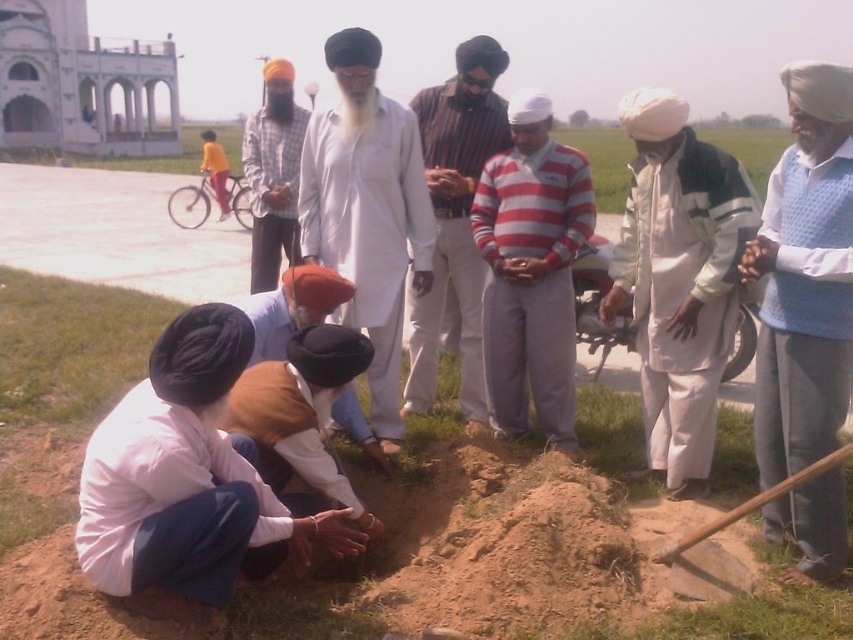
You are a farmer who needs to reach the person with the matte white turban at center from the white matte kurta at center. Given that your tractor has a turning radius of 2 meters, can you navigate your tractor between them without hitting either?

The distance between the white matte kurta at center and the matte white turban at center is 2.36 meters. Since the tractor requires a minimum turning radius of 2 meters, the tractor can navigate between them as the distance is sufficient to accommodate the turning radius.

You are a photographer standing at the camera position. You want to take a closeup photo of the white matte kurta at center. Can you walk closer to it without leaving the paved road shown in the scene?

The white matte kurta at center is 11.72 feet away from camera. Since the paved road is in the background and the group is near the mound of dirt, you can walk closer along the road to get a better shot.

You are a photographer trying to capture a clear shot of both the white matte kurta at center and the brown fabric turban at lower center. Which one should you focus on first to ensure it appears sharp in the photo?

The white matte kurta at center is further to the viewer than the brown fabric turban at lower center, so you should focus on the white matte kurta at center first to ensure both appear sharp.